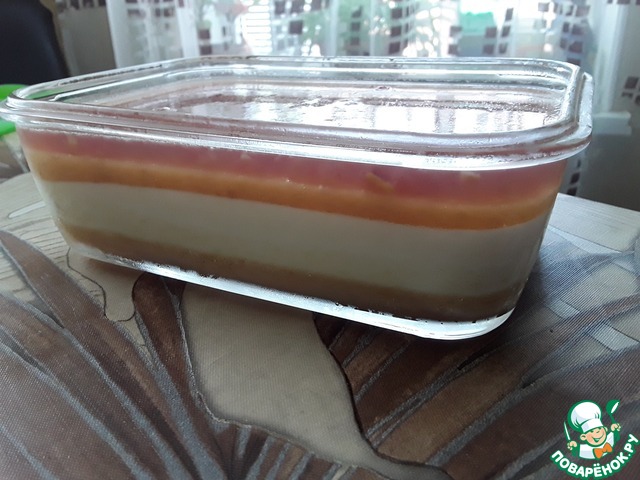
The image size is (640, 480). I want to click on glass dish, so click(x=470, y=150).